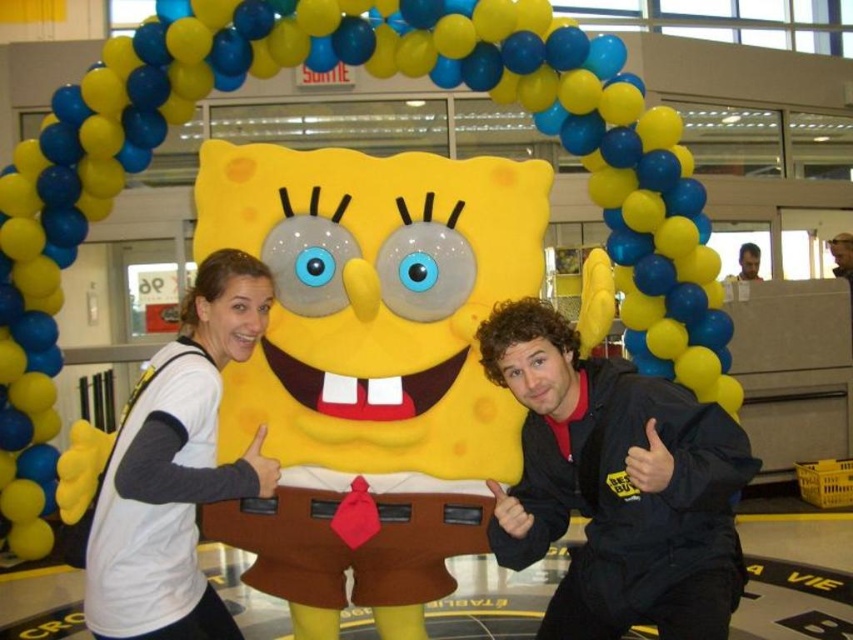
Question: Which object is the farthest from the black matte jacket at lower right?

Choices:
 (A) smooth leather jacket at upper right
 (B) white matte shirt at upper left

Answer: (A)

Question: Is black matte jacket at lower right behind smooth skin face at upper right?

Choices:
 (A) no
 (B) yes

Answer: (A)

Question: Can you confirm if black matte jacket at lower right is bigger than white matte shirt at upper left?

Choices:
 (A) yes
 (B) no

Answer: (A)

Question: Which object is the farthest from the white matte shirt at upper left?

Choices:
 (A) smooth leather jacket at upper right
 (B) black matte jacket at lower right

Answer: (A)

Question: Is white matte shirt at upper left positioned behind smooth leather jacket at upper right?

Choices:
 (A) no
 (B) yes

Answer: (A)

Question: Based on their relative distances, which object is nearer to the black matte jacket at lower right?

Choices:
 (A) smooth skin face at upper right
 (B) white matte shirt at upper left
 (C) smooth leather jacket at upper right

Answer: (B)